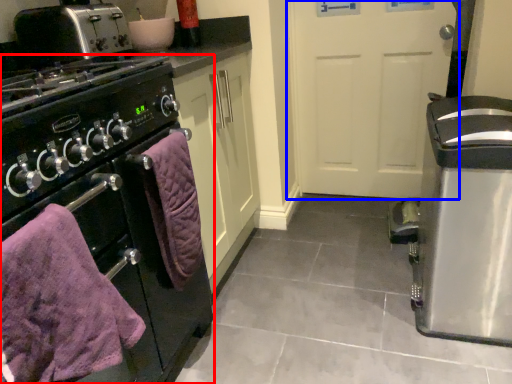
Question: Which object is closer to the camera taking this photo, home appliance (highlighted by a red box) or door (highlighted by a blue box)?

Choices:
 (A) home appliance
 (B) door

Answer: (A)